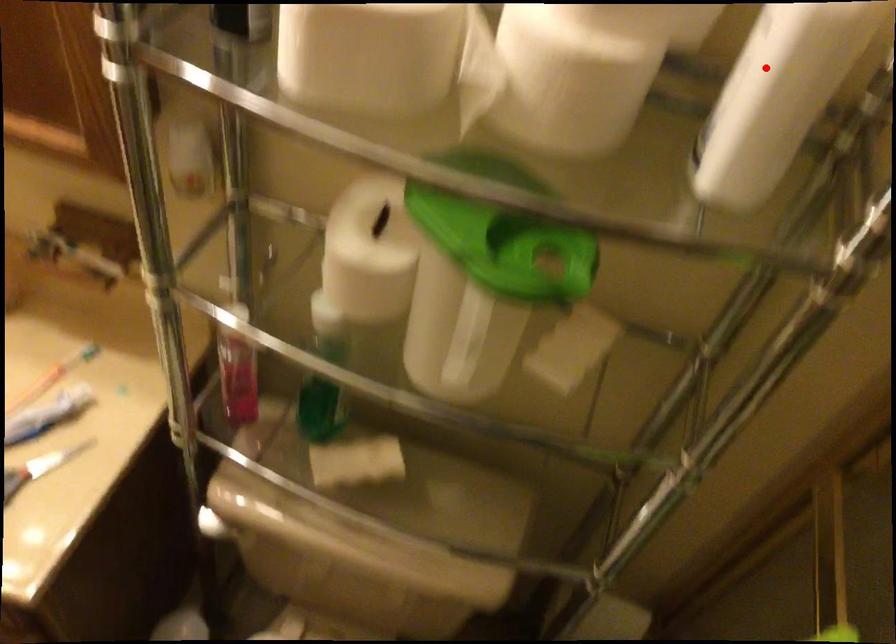
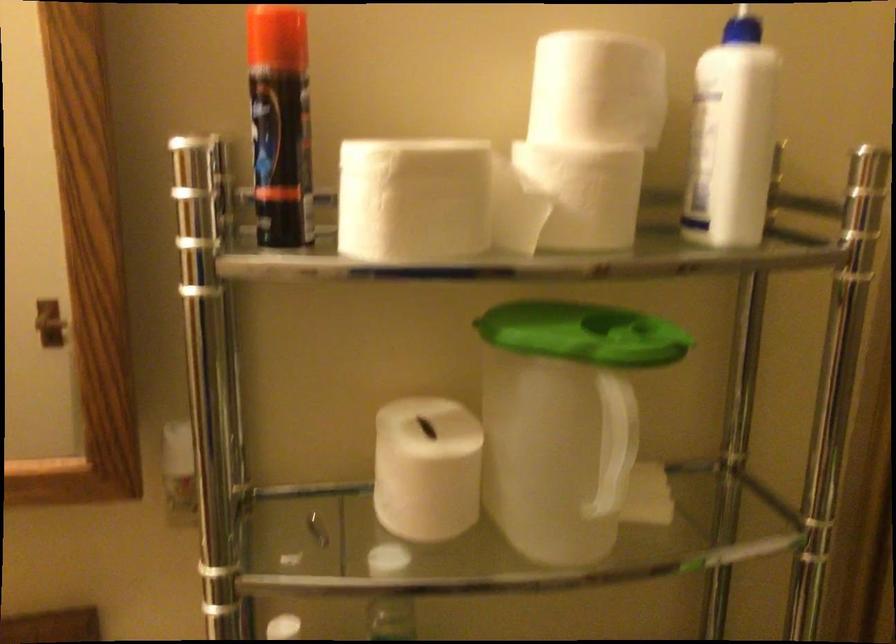
Question: I am providing you with two images of the same scene from different viewpoints. Image1 has a red point marked. In image2, the corresponding 3D location appears at what relative position? Reply with the corresponding letter.

Choices:
 (A) Closer
 (B) Farther

Answer: (B)